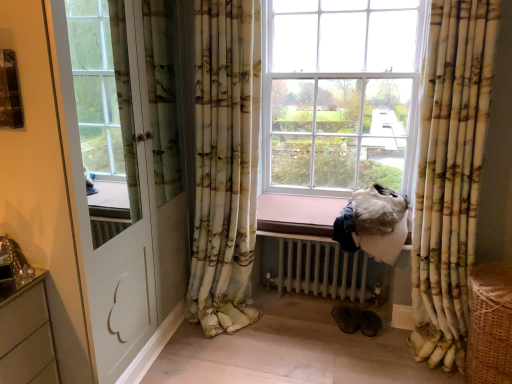
Where is `free spot to the right of floral fabric curtain at center, arranged as the 1th curtain when viewed from the left`? free spot to the right of floral fabric curtain at center, arranged as the 1th curtain when viewed from the left is located at coordinates (289, 336).